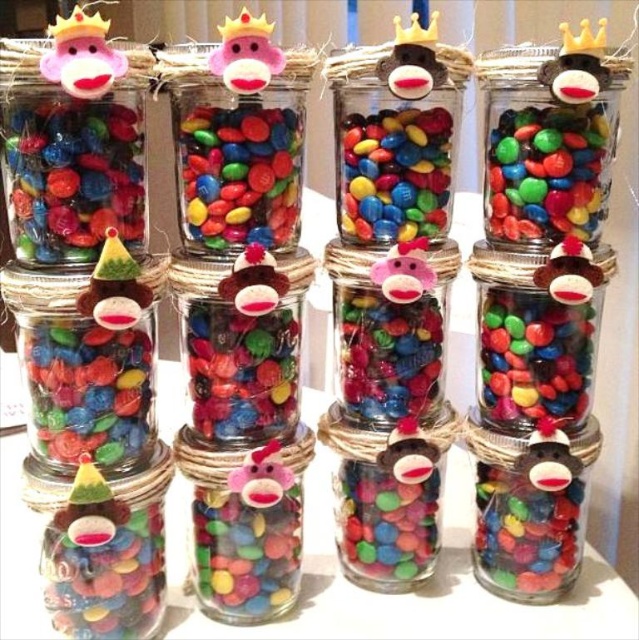
Question: Which object appears farthest from the camera in this image?

Choices:
 (A) shiny multicolored buttons at center
 (B) shiny multicolored candies at center right
 (C) shiny multicolored candies at center
 (D) matte plastic jar at center

Answer: (D)

Question: Can you confirm if shiny multicolored buttons at center is thinner than shiny multicolored candies at center?

Choices:
 (A) yes
 (B) no

Answer: (B)

Question: Among these objects, which one is nearest to the camera?

Choices:
 (A) shiny multicolored buttons at center
 (B) matte plastic jar at center

Answer: (A)

Question: Which object is the farthest from the matte plastic jar at center?

Choices:
 (A) shiny multicolored buttons at center
 (B) shiny multicolored candies at upper right
 (C) shiny multicolored candies at center right
 (D) matte plastic candy at center left

Answer: (D)

Question: Observing the image, what is the correct spatial positioning of matte plastic candy at center left in reference to shiny multicolored candies at center right?

Choices:
 (A) above
 (B) below

Answer: (A)

Question: Does matte plastic candy at center left appear under shiny multicolored candies at center?

Choices:
 (A) no
 (B) yes

Answer: (B)